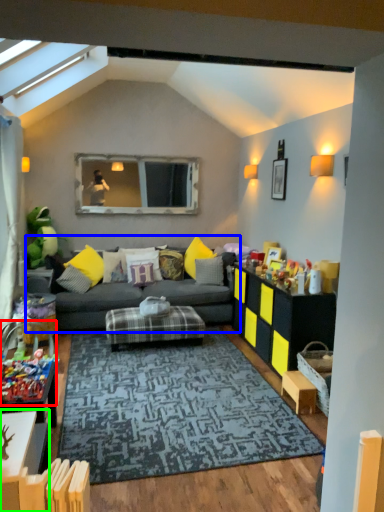
Question: Considering the real-world distances, which object is closest to toy (highlighted by a red box)? studio couch (highlighted by a blue box) or table (highlighted by a green box).

Choices:
 (A) studio couch
 (B) table

Answer: (B)